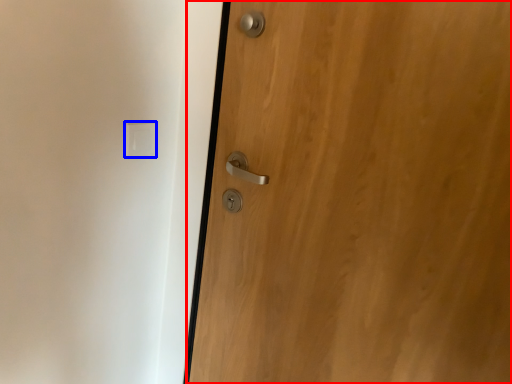
Question: Which point is further to the camera, door (highlighted by a red box) or light switch (highlighted by a blue box)?

Choices:
 (A) door
 (B) light switch

Answer: (B)